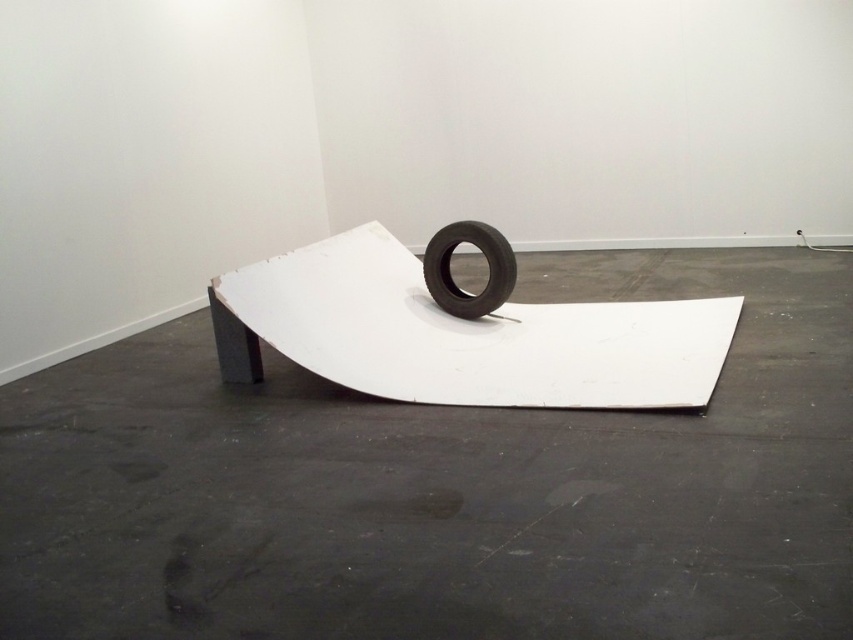
Consider the image. Between white matte ramp at center and black rubber tire at center, which one is positioned higher?

black rubber tire at center is higher up.

This screenshot has height=640, width=853. What do you see at coordinates (465, 330) in the screenshot? I see `white matte ramp at center` at bounding box center [465, 330].

Who is more forward, (672, 344) or (494, 252)?

Point (672, 344) is in front.

What are the coordinates of `white matte ramp at center` in the screenshot? It's located at (465, 330).